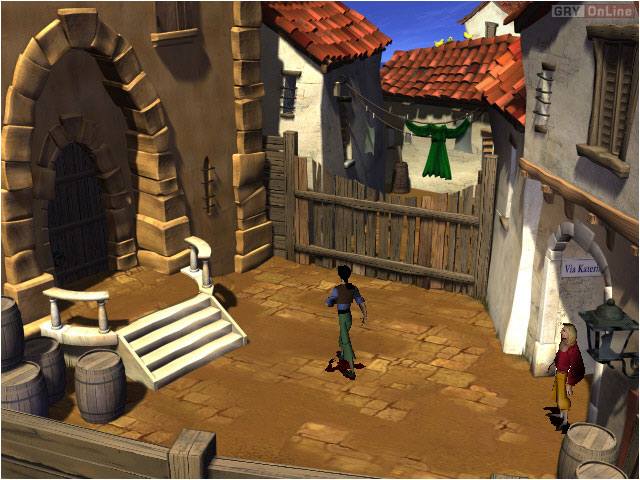
Find the location of a particular element. This screenshot has width=640, height=480. arched door is located at coordinates (93, 240).